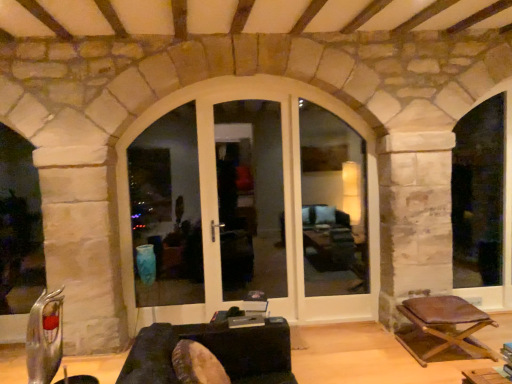
Locate an element on the screen. The width and height of the screenshot is (512, 384). blank space to the left of brown leather stool at lower right is located at coordinates (384, 361).